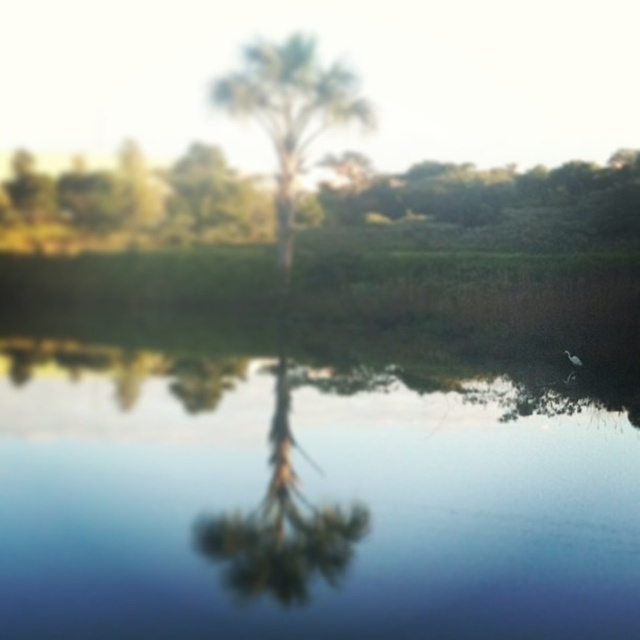
Does transparent blue water at center have a lesser height compared to green matte tree at center?

Incorrect, transparent blue water at center's height does not fall short of green matte tree at center's.

Which of these two, transparent blue water at center or green matte tree at center, stands taller?

With more height is transparent blue water at center.

Identify the location of transparent blue water at center. The height and width of the screenshot is (640, 640). (307, 484).

This screenshot has width=640, height=640. Find the location of `transparent blue water at center`. transparent blue water at center is located at coordinates (307, 484).

Between transparent blue water at center and green leafy tree at center, which one is positioned lower?

Positioned lower is transparent blue water at center.

Is transparent blue water at center to the right of green leafy tree at center from the viewer's perspective?

Yes, transparent blue water at center is to the right of green leafy tree at center.

Locate an element on the screen. transparent blue water at center is located at coordinates (307, 484).

This screenshot has height=640, width=640. Find the location of `transparent blue water at center`. transparent blue water at center is located at coordinates (307, 484).

Can you confirm if green matte tree at center is wider than green leafy tree at center?

No.

Between green matte tree at center and green leafy tree at center, which one appears on the left side from the viewer's perspective?

Positioned to the left is green leafy tree at center.

Is point (278, 502) positioned after point (291, 115)?

No, it is not.

Identify the location of green matte tree at center. (282, 525).